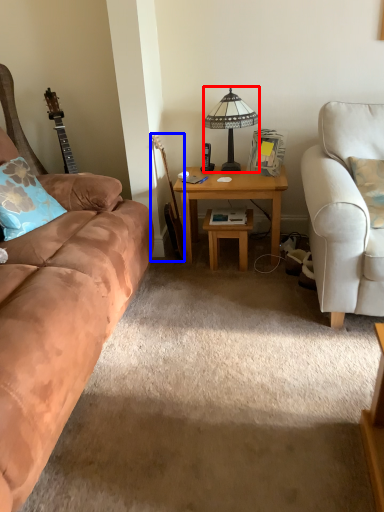
Question: Among these objects, which one is nearest to the camera, lamp (highlighted by a red box) or guitar (highlighted by a blue box)?

Choices:
 (A) lamp
 (B) guitar

Answer: (A)